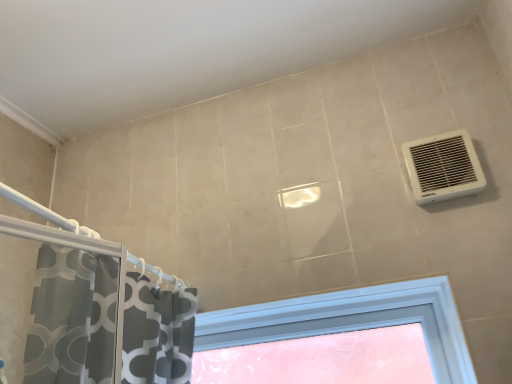
Question: From the image's perspective, is white plastic vent at upper right located above or below translucent plastic window at center?

Choices:
 (A) above
 (B) below

Answer: (A)

Question: Is point (444, 178) positioned closer to the camera than point (210, 336)?

Choices:
 (A) farther
 (B) closer

Answer: (B)

Question: Considering the positions of white plastic vent at upper right and translucent plastic window at center in the image, is white plastic vent at upper right wider or thinner than translucent plastic window at center?

Choices:
 (A) thin
 (B) wide

Answer: (A)

Question: Considering the positions of translucent plastic window at center and white plastic vent at upper right in the image, is translucent plastic window at center taller or shorter than white plastic vent at upper right?

Choices:
 (A) short
 (B) tall

Answer: (B)

Question: In the image, is translucent plastic window at center on the left side or the right side of white plastic vent at upper right?

Choices:
 (A) right
 (B) left

Answer: (B)

Question: In the image, is translucent plastic window at center positioned in front of or behind white plastic vent at upper right?

Choices:
 (A) front
 (B) behind

Answer: (B)

Question: Considering the positions of translucent plastic window at center and white plastic vent at upper right in the image, is translucent plastic window at center wider or thinner than white plastic vent at upper right?

Choices:
 (A) thin
 (B) wide

Answer: (B)